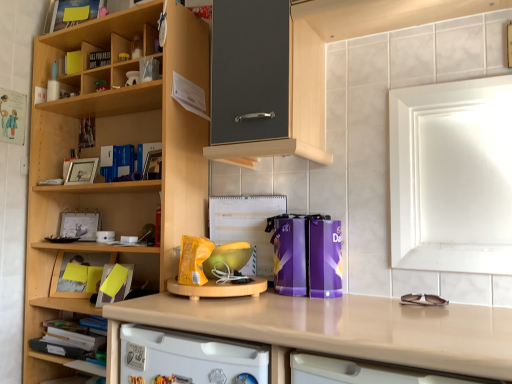
What do you see at coordinates (73, 62) in the screenshot? I see `yellow matte bookshelf at upper left, the 1th book positioned from the top` at bounding box center [73, 62].

The width and height of the screenshot is (512, 384). What do you see at coordinates (99, 59) in the screenshot?
I see `matte black book at upper left, placed as the second book when sorted from front to back` at bounding box center [99, 59].

What is the approximate height of matte black book at upper left, which ranks as the third book in back-to-front order?

matte black book at upper left, which ranks as the third book in back-to-front order, is 3.99 inches tall.

Image resolution: width=512 pixels, height=384 pixels. What do you see at coordinates (452, 176) in the screenshot?
I see `white glossy medicine cabinet at upper right` at bounding box center [452, 176].

Describe the element at coordinates (188, 358) in the screenshot. I see `white glossy dishwasher at lower center` at that location.

At what (x,y) coordinates should I click in order to perform the action: click on yellow matte bookshelf at upper left, the 1th book positioned from the left. Please return your answer as a coordinate pair (x, y). The image size is (512, 384). Looking at the image, I should click on (73, 62).

Is wooden cupboard at left surrounded by matte black book at upper left, which ranks as the second book in top-to-bottom order?

No, wooden cupboard at left is not inside matte black book at upper left, which ranks as the second book in top-to-bottom order.

Is matte black book at upper left, placed as the second book when sorted from front to back, shorter than wooden cupboard at left?

Indeed, matte black book at upper left, placed as the second book when sorted from front to back, has a lesser height compared to wooden cupboard at left.

From the image's perspective, is matte black book at upper left, placed as the second book when sorted from front to back, on top of wooden cupboard at left?

Yes.

From a real-world perspective, is matte black book at upper left, arranged as the third book when viewed from the left, positioned under wooden cupboard at left based on gravity?

Incorrect, from a real-world perspective, matte black book at upper left, arranged as the third book when viewed from the left, is higher than wooden cupboard at left.

Does yellow matte bookshelf at upper left, placed as the 2th book when sorted from back to front, have a smaller size compared to matte black book at upper left, placed as the second book when sorted from front to back?

Correct, yellow matte bookshelf at upper left, placed as the 2th book when sorted from back to front, occupies less space than matte black book at upper left, placed as the second book when sorted from front to back.

Which of these two, yellow matte bookshelf at upper left, which ranks as the 4th book in bottom-to-top order, or matte black book at upper left, which ranks as the second book in top-to-bottom order, stands taller?

yellow matte bookshelf at upper left, which ranks as the 4th book in bottom-to-top order, is taller.

Is point (69, 52) positioned in front of point (109, 52)?

No, (69, 52) is further to viewer.

How many degrees apart are the facing directions of white glossy dishwasher at lower center and white glossy medicine cabinet at upper right?

The angle between the facing direction of white glossy dishwasher at lower center and the facing direction of white glossy medicine cabinet at upper right is 0.8 degrees.

Find the location of a particular element. dish washer lying on the left of white glossy medicine cabinet at upper right is located at coordinates (188, 358).

Is white glossy dishwasher at lower center shorter than white glossy medicine cabinet at upper right?

Yes.

Does yellow paper at left have a greater height compared to beige laminate countertop at center?

Incorrect, the height of yellow paper at left is not larger of that of beige laminate countertop at center.

From the image's perspective, which object appears higher, yellow paper at left or beige laminate countertop at center?

yellow paper at left, from the image's perspective.

Does yellow paper at left have a lesser width compared to beige laminate countertop at center?

Indeed, yellow paper at left has a lesser width compared to beige laminate countertop at center.

Looking at this image, how many degrees apart are the facing directions of yellow paper at left and beige laminate countertop at center?

yellow paper at left and beige laminate countertop at center are facing 24 degrees away from each other.

Considering the sizes of objects beige laminate countertop at center and matte black photo frame at upper left, which appears as the second book when ordered from the bottom, in the image provided, who is smaller, beige laminate countertop at center or matte black photo frame at upper left, which appears as the second book when ordered from the bottom,?

With smaller size is matte black photo frame at upper left, which appears as the second book when ordered from the bottom.

Which of these two, beige laminate countertop at center or matte black photo frame at upper left, placed as the 3th book when sorted from top to bottom, stands shorter?

matte black photo frame at upper left, placed as the 3th book when sorted from top to bottom, is shorter.

In the scene shown: Considering the relative positions of beige laminate countertop at center and matte black photo frame at upper left, arranged as the 2th book when viewed from the left, in the image provided, is beige laminate countertop at center to the left of matte black photo frame at upper left, arranged as the 2th book when viewed from the left, from the viewer's perspective?

In fact, beige laminate countertop at center is to the right of matte black photo frame at upper left, arranged as the 2th book when viewed from the left.

What's the angular difference between beige laminate countertop at center and matte black photo frame at upper left, the 1th book in the back-to-front sequence,'s facing directions?

They differ by 10.5 degrees in their facing directions.

Can you confirm if matte black book at upper left, placed as the second book when sorted from front to back, is taller than beige laminate countertop at center?

Incorrect, the height of matte black book at upper left, placed as the second book when sorted from front to back, is not larger of that of beige laminate countertop at center.

In terms of size, does matte black book at upper left, which ranks as the second book in top-to-bottom order, appear bigger or smaller than beige laminate countertop at center?

In the image, matte black book at upper left, which ranks as the second book in top-to-bottom order, appears to be smaller than beige laminate countertop at center.

Would you say beige laminate countertop at center is part of matte black book at upper left, which ranks as the second book in top-to-bottom order,'s contents?

That's incorrect, beige laminate countertop at center is not inside matte black book at upper left, which ranks as the second book in top-to-bottom order.

In the scene shown: From the image's perspective, between yellow paper at left and yellow matte bookshelf at upper left, placed as the fourth book when sorted from right to left, which one is located above?

yellow matte bookshelf at upper left, placed as the fourth book when sorted from right to left, is shown above in the image.

Would you say yellow paper at left is a long distance from yellow matte bookshelf at upper left, acting as the 3th book starting from the front?

yellow paper at left is actually quite close to yellow matte bookshelf at upper left, acting as the 3th book starting from the front.

Who is smaller, yellow paper at left or yellow matte bookshelf at upper left, the 1th book positioned from the left?

Smaller between the two is yellow matte bookshelf at upper left, the 1th book positioned from the left.

This screenshot has height=384, width=512. What are the coordinates of `book that is the 1st object to the left of the wooden cupboard at left, starting at the anchor` in the screenshot? It's located at (99, 59).

The image size is (512, 384). In the image, there is a matte black book at upper left, which ranks as the third book in back-to-front order. What are the coordinates of `book above it (from the image's perspective)` in the screenshot? It's located at (73, 62).

Estimate the real-world distances between objects in this image. Which object is further from wooden cupboard at left, white glossy medicine cabinet at upper right or yellow matte bookshelf at upper left, the 1th book positioned from the left?

white glossy medicine cabinet at upper right lies further to wooden cupboard at left than the other object.

Which object lies further to the anchor point yellow matte bookshelf at upper left, which ranks as the 4th book in bottom-to-top order, wooden cupboard at left or wooden shelf at lower left?

Based on the image, wooden shelf at lower left appears to be further to yellow matte bookshelf at upper left, which ranks as the 4th book in bottom-to-top order.

When comparing their distances from yellow matte bookshelf at upper left, acting as the 3th book starting from the front, does matte black book at upper left, which ranks as the third book in back-to-front order, or white glossy medicine cabinet at upper right seem closer?

Based on the image, matte black book at upper left, which ranks as the third book in back-to-front order, appears to be nearer to yellow matte bookshelf at upper left, acting as the 3th book starting from the front.

Estimate the real-world distances between objects in this image. Which object is closer to beige laminate countertop at center, matte black photo frame at upper left, the 1th book in the back-to-front sequence, or matte black book at upper left, which is the 3th book in bottom-to-top order?

matte black photo frame at upper left, the 1th book in the back-to-front sequence, is closer to beige laminate countertop at center.

Based on the photo, estimate the real-world distances between objects in this image. Which object is further from yellow paper at left, wooden shelf at lower left or yellow paper at lower left, which is the 1th book from right to left?

wooden shelf at lower left.

Considering their positions, is wooden cupboard at left positioned closer to white glossy dishwasher at lower center than yellow paper at left?

wooden cupboard at left is positioned closer to the anchor white glossy dishwasher at lower center.

In the scene shown: When comparing their distances from wooden shelf at lower left, does yellow matte bookshelf at upper left, which ranks as the 4th book in bottom-to-top order, or yellow paper at lower left, which is the fourth book from left to right, seem further?

yellow matte bookshelf at upper left, which ranks as the 4th book in bottom-to-top order.

Estimate the real-world distances between objects in this image. Which object is closer to wooden cupboard at left, wooden shelf at lower left or yellow matte bookshelf at upper left, which ranks as the 4th book in bottom-to-top order?

Based on the image, yellow matte bookshelf at upper left, which ranks as the 4th book in bottom-to-top order, appears to be nearer to wooden cupboard at left.

Image resolution: width=512 pixels, height=384 pixels. I want to click on countertop located between wooden cupboard at left and white glossy medicine cabinet at upper right in the left-right direction, so click(x=334, y=330).

Identify the location of cupboard between matte black photo frame at upper left, placed as the 3th book when sorted from top to bottom, and yellow paper at lower left, which appears as the fourth book when viewed from the back, vertically. click(114, 144).

Find the location of a particular element. The width and height of the screenshot is (512, 384). cupboard positioned between white glossy dishwasher at lower center and yellow paper at lower left, which is the 1th book from right to left, from near to far is located at coordinates (114, 144).

You are a GUI agent. You are given a task and a screenshot of the screen. Output one action in this format:
    pyautogui.click(x=<x>, y=<y>)
    Task: Click on the cupboard between matte black book at upper left, acting as the 2th book starting from the right, and white glossy dishwasher at lower center from top to bottom
    The width and height of the screenshot is (512, 384).
    Given the screenshot: What is the action you would take?
    pyautogui.click(x=114, y=144)